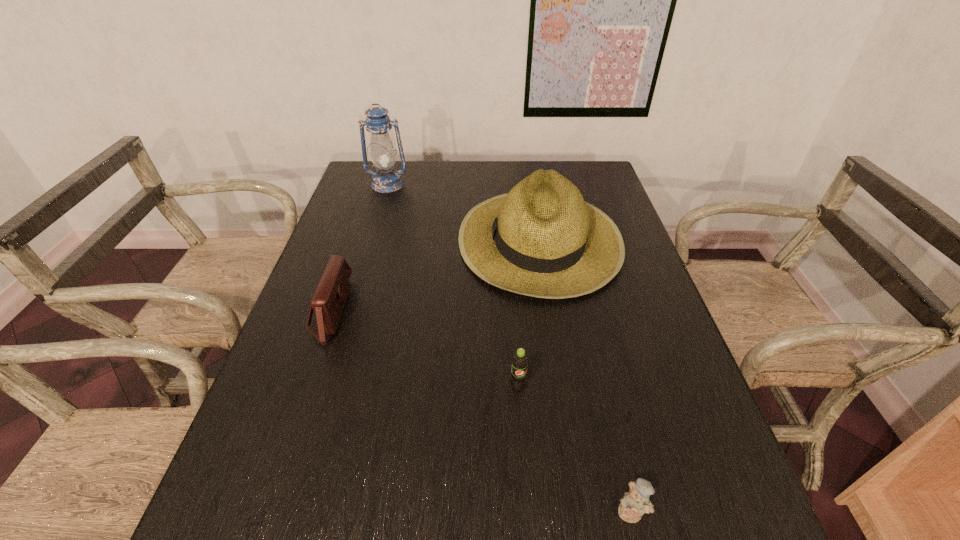
The height and width of the screenshot is (540, 960). Find the location of `lantern situated at the far edge`. lantern situated at the far edge is located at coordinates (386, 179).

Locate an element on the screen. This screenshot has width=960, height=540. sunhat present at the far edge is located at coordinates (542, 239).

Identify the location of lantern at the left edge. This screenshot has width=960, height=540. (386, 179).

The image size is (960, 540). Find the location of `shoulder bag at the left edge`. shoulder bag at the left edge is located at coordinates (328, 302).

You are a GUI agent. You are given a task and a screenshot of the screen. Output one action in this format:
    pyautogui.click(x=<x>, y=<y>)
    Task: Click on the object that is at the right edge
    
    Given the screenshot: What is the action you would take?
    pyautogui.click(x=542, y=239)

Find the location of a particular element. The height and width of the screenshot is (540, 960). object that is at the far left corner is located at coordinates (386, 179).

In order to click on object that is at the far right corner in this screenshot , I will do `click(542, 239)`.

This screenshot has width=960, height=540. Find the location of `vacant space at the far edge of the desktop`. vacant space at the far edge of the desktop is located at coordinates (403, 179).

The width and height of the screenshot is (960, 540). Identify the location of vacant space at the left edge of the desktop. (309, 336).

This screenshot has width=960, height=540. Find the location of `vacant space at the right edge of the desktop`. vacant space at the right edge of the desktop is located at coordinates (671, 360).